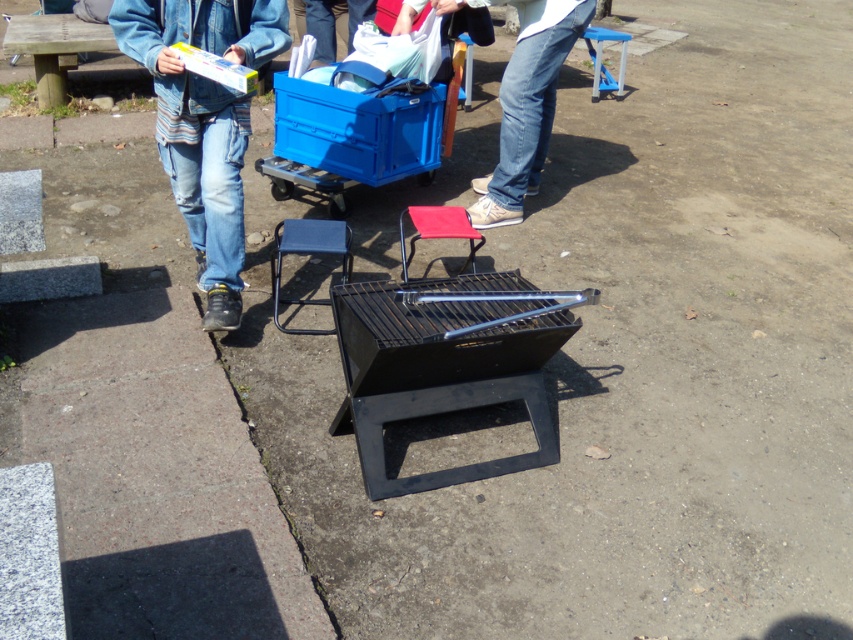
Question: Is denim jeans at left to the left of red fabric stool at center from the viewer's perspective?

Choices:
 (A) yes
 (B) no

Answer: (A)

Question: Is denim jeans at left wider than red fabric stool at center?

Choices:
 (A) no
 (B) yes

Answer: (B)

Question: Is denim jeans at left to the right of blue metal stool at center from the viewer's perspective?

Choices:
 (A) yes
 (B) no

Answer: (B)

Question: Which object appears farthest from the camera in this image?

Choices:
 (A) blue metal stool at center
 (B) blue plastic stool at upper right
 (C) red fabric stool at center
 (D) black matte grill at center

Answer: (B)

Question: Among these objects, which one is farthest from the camera?

Choices:
 (A) red fabric stool at center
 (B) jeans at center

Answer: (B)

Question: Which of the following is the farthest from the observer?

Choices:
 (A) (196, 4)
 (B) (520, 392)

Answer: (A)